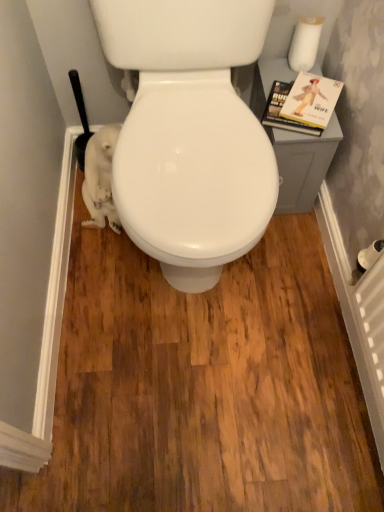
Question: From a real-world perspective, is white matte toilet paper at upper right physically below hardcover book at upper right?

Choices:
 (A) no
 (B) yes

Answer: (A)

Question: Can you confirm if white matte toilet paper at upper right is shorter than hardcover book at upper right?

Choices:
 (A) yes
 (B) no

Answer: (B)

Question: From the image's perspective, is white matte toilet paper at upper right located beneath hardcover book at upper right?

Choices:
 (A) no
 (B) yes

Answer: (A)

Question: Could you tell me if white matte toilet paper at upper right is turned towards hardcover book at upper right?

Choices:
 (A) no
 (B) yes

Answer: (B)

Question: Considering the relative sizes of white matte toilet paper at upper right and hardcover book at upper right in the image provided, is white matte toilet paper at upper right bigger than hardcover book at upper right?

Choices:
 (A) no
 (B) yes

Answer: (A)

Question: Is hardcover book at upper right completely or partially inside white matte toilet paper at upper right?

Choices:
 (A) no
 (B) yes

Answer: (A)

Question: Is hardcover book at upper right not close to white matte toilet paper at upper right?

Choices:
 (A) no
 (B) yes

Answer: (A)

Question: Can you confirm if hardcover book at upper right is bigger than white matte toilet paper at upper right?

Choices:
 (A) no
 (B) yes

Answer: (B)

Question: Can you confirm if hardcover book at upper right is smaller than white matte toilet paper at upper right?

Choices:
 (A) no
 (B) yes

Answer: (A)

Question: From the image's perspective, is hardcover book at upper right under white matte toilet paper at upper right?

Choices:
 (A) yes
 (B) no

Answer: (A)

Question: From a real-world perspective, is hardcover book at upper right beneath white matte toilet paper at upper right?

Choices:
 (A) no
 (B) yes

Answer: (B)

Question: From a real-world perspective, is hardcover book at upper right located higher than white matte toilet paper at upper right?

Choices:
 (A) no
 (B) yes

Answer: (A)

Question: In terms of height, does hardcover book at upper right look taller or shorter compared to white matte toilet paper at upper right?

Choices:
 (A) short
 (B) tall

Answer: (A)